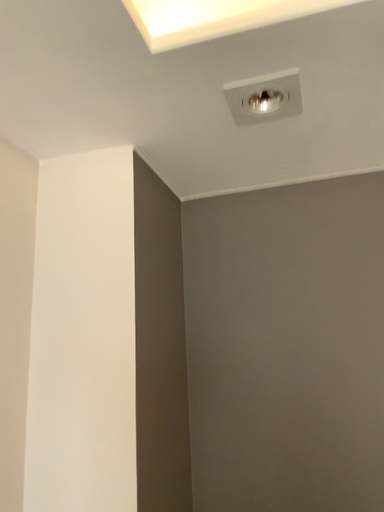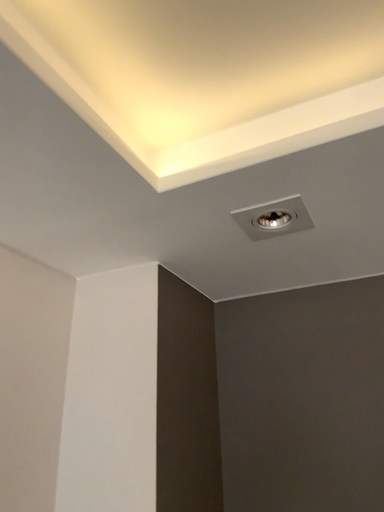
Question: Which way did the camera rotate in the video?

Choices:
 (A) rotated downward
 (B) rotated upward

Answer: (B)